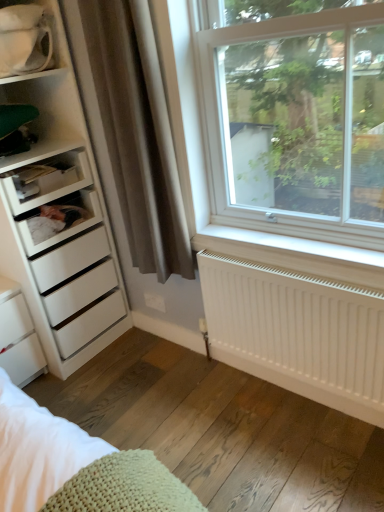
Question: Does white matte drawer at left, marked as the 1th shelf in a bottom-to-top arrangement, have a lesser height compared to white plastic shelf at left, the 2th shelf ordered from the bottom?

Choices:
 (A) no
 (B) yes

Answer: (B)

Question: Is the position of white matte drawer at left, marked as the 1th shelf in a bottom-to-top arrangement, less distant than that of white plastic shelf at left, the 2th shelf ordered from the bottom?

Choices:
 (A) yes
 (B) no

Answer: (B)

Question: From the image's perspective, is white matte drawer at left, marked as the third shelf in a top-to-bottom arrangement, located beneath white plastic shelf at left, the 2th shelf ordered from the bottom?

Choices:
 (A) yes
 (B) no

Answer: (A)

Question: Does white matte drawer at left, marked as the 1th shelf in a bottom-to-top arrangement, contain white plastic shelf at left, the 2th shelf ordered from the bottom?

Choices:
 (A) yes
 (B) no

Answer: (B)

Question: Does white matte drawer at left, marked as the third shelf in a top-to-bottom arrangement, have a greater height compared to white plastic shelf at left, the 2th shelf from the top?

Choices:
 (A) yes
 (B) no

Answer: (B)

Question: From a real-world perspective, is white matte drawer at left, marked as the third shelf in a top-to-bottom arrangement, physically below white plastic shelf at left, the 2th shelf ordered from the bottom?

Choices:
 (A) yes
 (B) no

Answer: (A)

Question: Does white plastic shelf at left, the 2th shelf from the top, have a smaller size compared to white matte drawer at left, marked as the 1th shelf in a bottom-to-top arrangement?

Choices:
 (A) no
 (B) yes

Answer: (A)

Question: Is white plastic shelf at left, the 2th shelf ordered from the bottom, next to white matte drawer at left, marked as the third shelf in a top-to-bottom arrangement?

Choices:
 (A) no
 (B) yes

Answer: (A)

Question: Are white plastic shelf at left, the 2th shelf from the top, and white matte drawer at left, marked as the 1th shelf in a bottom-to-top arrangement, far apart?

Choices:
 (A) no
 (B) yes

Answer: (A)

Question: Can you confirm if white plastic shelf at left, the 2th shelf ordered from the bottom, is wider than white matte drawer at left, marked as the 1th shelf in a bottom-to-top arrangement?

Choices:
 (A) no
 (B) yes

Answer: (A)

Question: Is white plastic shelf at left, the 2th shelf ordered from the bottom, located outside white matte drawer at left, marked as the 1th shelf in a bottom-to-top arrangement?

Choices:
 (A) yes
 (B) no

Answer: (A)

Question: Considering the relative positions of white plastic shelf at left, the 2th shelf ordered from the bottom, and white matte drawer at left, marked as the third shelf in a top-to-bottom arrangement, in the image provided, is white plastic shelf at left, the 2th shelf ordered from the bottom, to the right of white matte drawer at left, marked as the third shelf in a top-to-bottom arrangement, from the viewer's perspective?

Choices:
 (A) no
 (B) yes

Answer: (A)

Question: Are white matte radiator at lower right and white plastic shelf at left, the 2th shelf from the top, far apart?

Choices:
 (A) yes
 (B) no

Answer: (A)